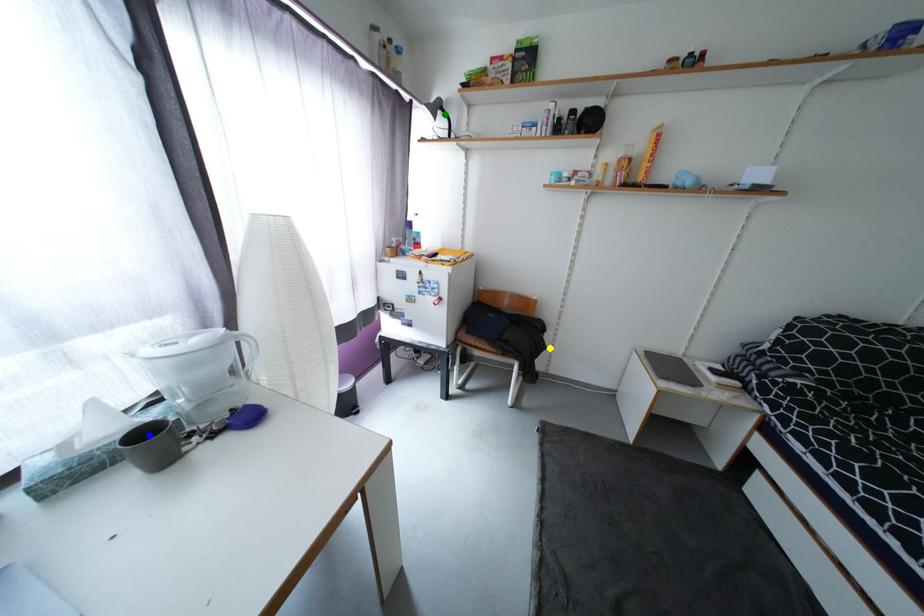
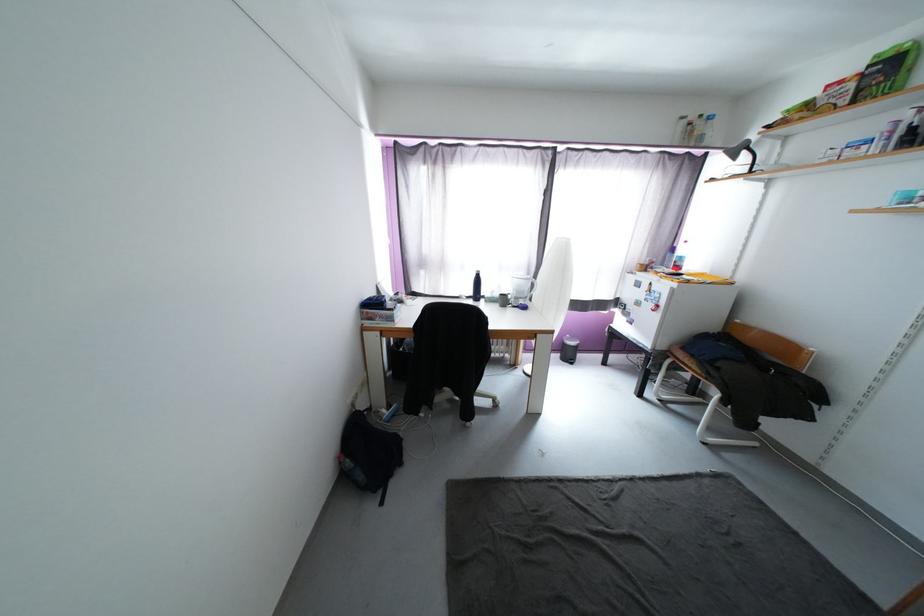
I am providing you with two images of the same scene from different viewpoints. Three points are marked in image1. Which point corresponds to a part or object that is occluded in image2?In image1, three points are marked. Which of them correspond to a part or object that is occluded in image2?Among the three points shown in image1, which one corresponds to a part or object that is no longer visible due to occlusion in image2?

blue point cannot be seen in image2.